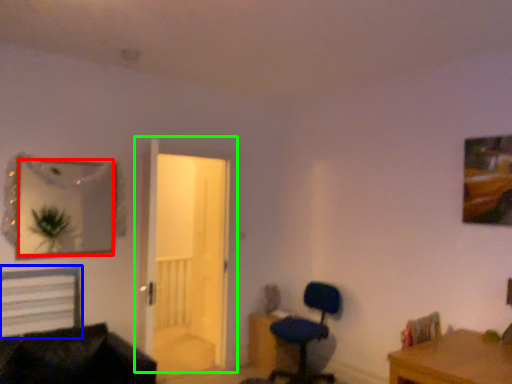
Question: Estimate the real-world distances between objects in this image. Which object is closer to mirror (highlighted by a red box), bed (highlighted by a blue box) or door (highlighted by a green box)?

Choices:
 (A) bed
 (B) door

Answer: (A)